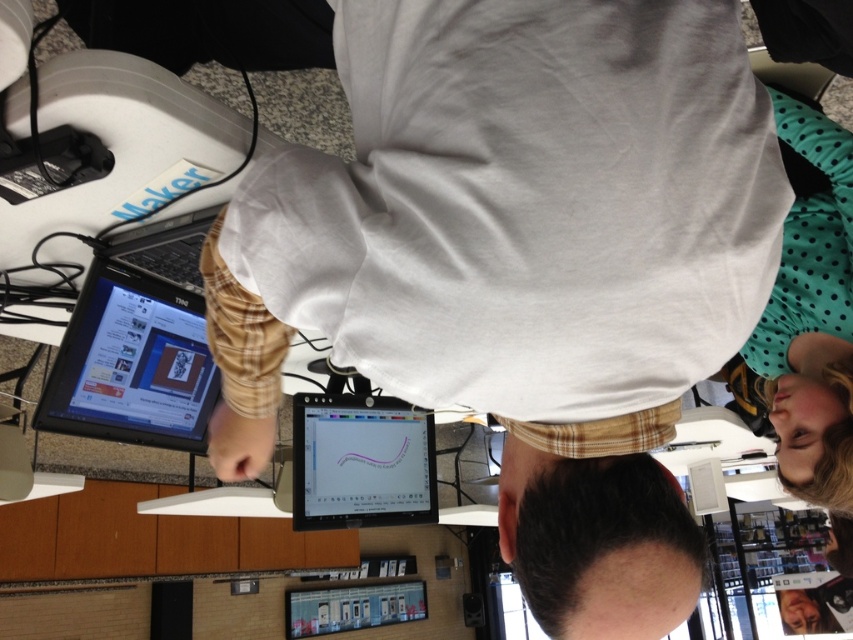
In the scene shown: You are holding a camera and want to take a photo of the point at coordinates (308, 236). The camera is currently 64.23 centimeters away from the point. If the camera needs to be at least 50 centimeters away to capture the point clearly, can you take a clear photo?

The camera is 64.23 centimeters away from the point at coordinates (308, 236), which is more than the required 50 centimeters. Therefore, you can take a clear photo.

You are standing behind the desk and want to reach the black glossy tablet at left to check an email. However, there is a white cotton shirt at center in your way. Can you move the shirt to access the tablet?

The white cotton shirt at center is in front of the black glossy tablet at left, so you can move the shirt to access the tablet.

You are trying to reach for the matte plastic tablet at center and the black plastic laptop at upper left on the desk. Which device is positioned lower on the desk?

The matte plastic tablet at center is located below the black plastic laptop at upper left, so it is positioned lower on the desk.